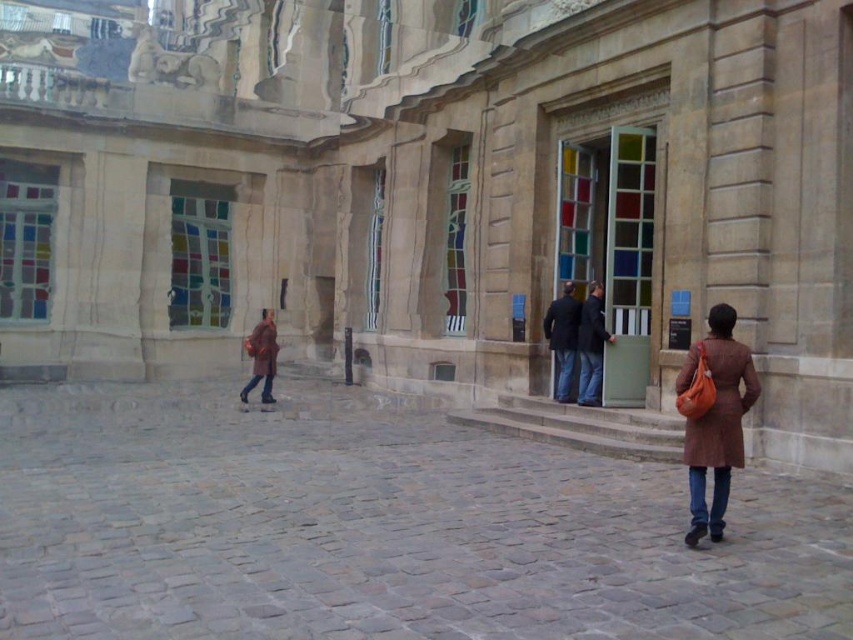
You are standing in the courtyard and want to approach the person wearing the brown wool coat at right. Which direction should you move to avoid walking behind the brown leather coat at lower left?

To approach the brown wool coat at right without walking behind the brown leather coat at lower left, move towards the right side of the scene since the brown wool coat at right is in front of the brown leather coat at lower left.